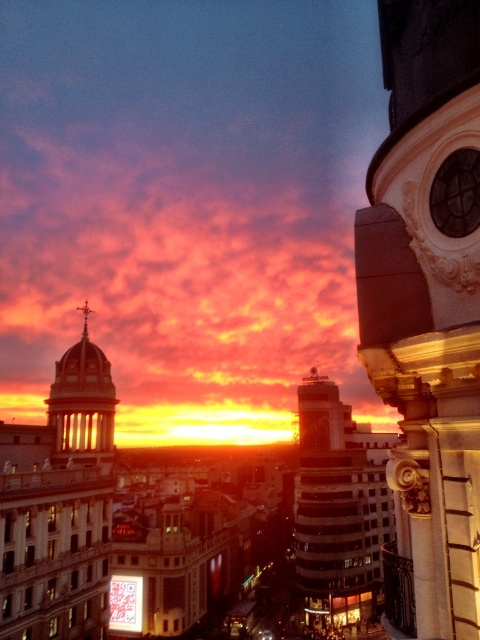
Question: Can you confirm if gold ornate tower at upper right is positioned to the left of white striped tower at center?

Choices:
 (A) no
 (B) yes

Answer: (B)

Question: Which of the following is the closest to the observer?

Choices:
 (A) matte gold dome at center-left
 (B) white striped tower at center

Answer: (A)

Question: Which point is closer to the camera?

Choices:
 (A) (80, 368)
 (B) (407, 397)
 (C) (4, 598)

Answer: (B)

Question: Does white striped tower at center come behind matte gold dome at center-left?

Choices:
 (A) yes
 (B) no

Answer: (A)

Question: Which point is farther to the camera?

Choices:
 (A) (45, 481)
 (B) (76, 445)
 (C) (384, 236)

Answer: (B)

Question: Can you confirm if matte gold dome at left is positioned above matte gold dome at center-left?

Choices:
 (A) yes
 (B) no

Answer: (B)